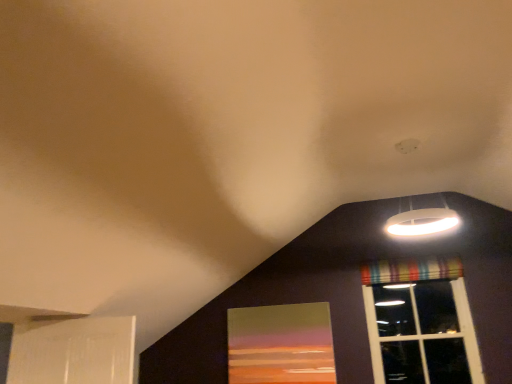
Question: From a real-world perspective, is striped fabric window at upper right over matte glass window screen at lower center?

Choices:
 (A) no
 (B) yes

Answer: (B)

Question: Is striped fabric window at upper right shorter than matte glass window screen at lower center?

Choices:
 (A) yes
 (B) no

Answer: (B)

Question: Is striped fabric window at upper right smaller than matte glass window screen at lower center?

Choices:
 (A) yes
 (B) no

Answer: (B)

Question: Is the position of striped fabric window at upper right more distant than that of matte glass window screen at lower center?

Choices:
 (A) yes
 (B) no

Answer: (B)

Question: Would you say striped fabric window at upper right contains matte glass window screen at lower center?

Choices:
 (A) no
 (B) yes

Answer: (A)

Question: Can you confirm if striped fabric window at upper right is taller than matte glass window screen at lower center?

Choices:
 (A) no
 (B) yes

Answer: (B)

Question: Is the depth of striped fabric window at upper right less than that of white matte lampshade at upper right?

Choices:
 (A) no
 (B) yes

Answer: (A)

Question: Considering the relative sizes of striped fabric window at upper right and white matte lampshade at upper right in the image provided, is striped fabric window at upper right taller than white matte lampshade at upper right?

Choices:
 (A) yes
 (B) no

Answer: (A)

Question: Is striped fabric window at upper right at the right side of white matte lampshade at upper right?

Choices:
 (A) yes
 (B) no

Answer: (A)

Question: Considering the relative positions of striped fabric window at upper right and white matte lampshade at upper right in the image provided, is striped fabric window at upper right to the left of white matte lampshade at upper right from the viewer's perspective?

Choices:
 (A) yes
 (B) no

Answer: (B)

Question: Is the position of striped fabric window at upper right more distant than that of white matte lampshade at upper right?

Choices:
 (A) no
 (B) yes

Answer: (B)

Question: Is striped fabric window at upper right not inside white matte lampshade at upper right?

Choices:
 (A) no
 (B) yes

Answer: (B)

Question: Is white matte lampshade at upper right outside of matte glass window screen at lower center?

Choices:
 (A) no
 (B) yes

Answer: (B)